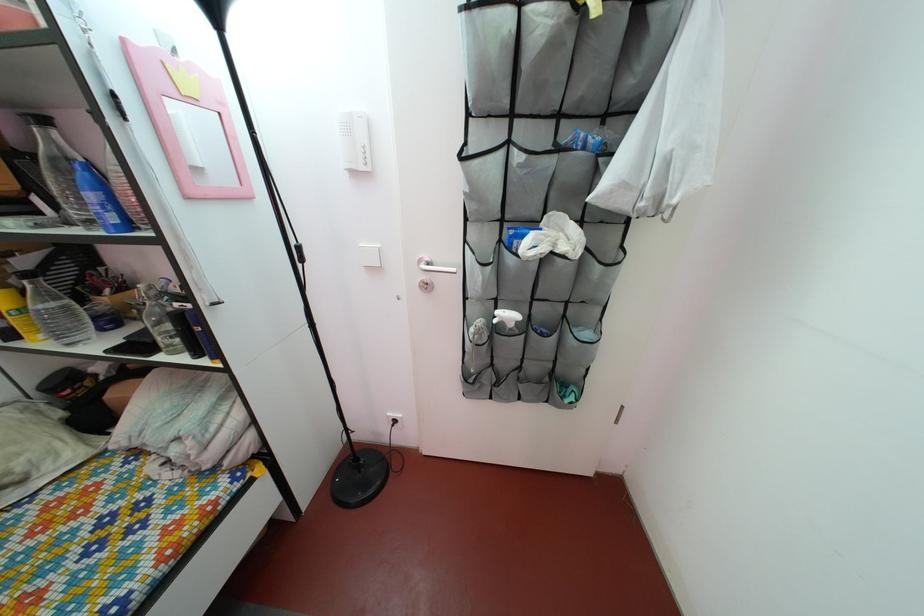
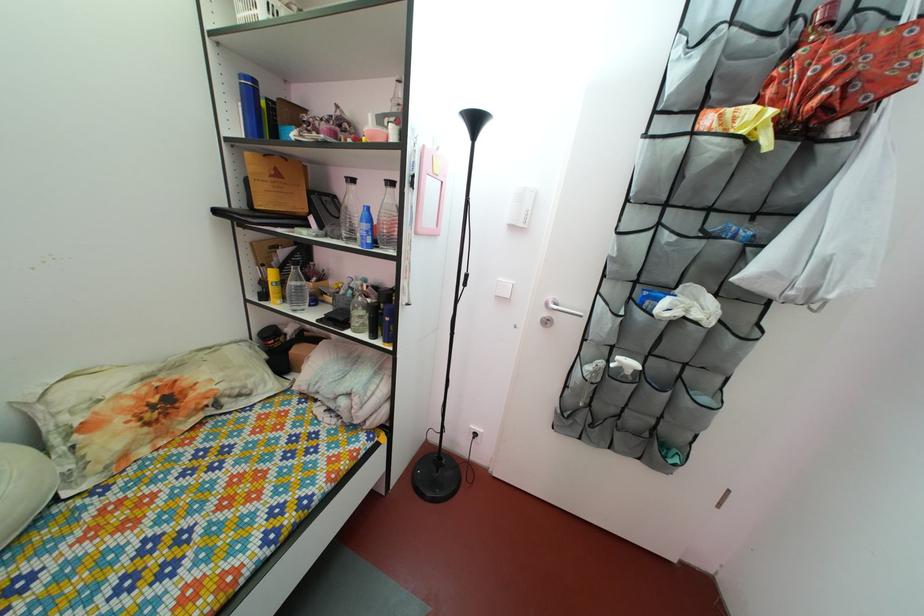
Locate, in the second image, the point that corresponds to point 438,272 in the first image.

(565, 313)